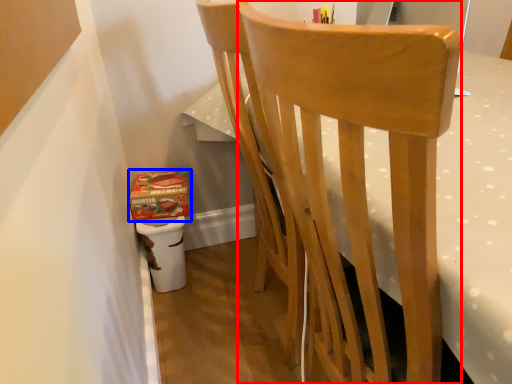
Question: Among these objects, which one is farthest to the camera, chair (highlighted by a red box) or box (highlighted by a blue box)?

Choices:
 (A) chair
 (B) box

Answer: (B)